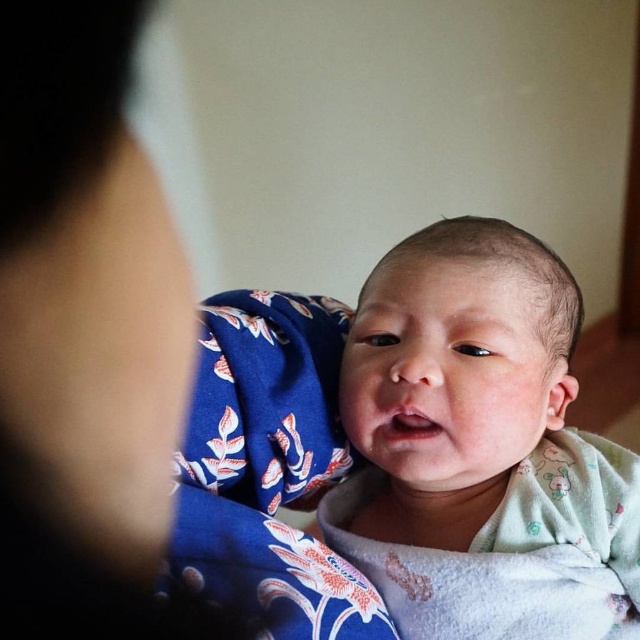
You are a photographer taking a closeup shot of a baby. You notice the smooth skin at upper left and the soft white swaddle at center. Which object is wider?

The smooth skin at upper left has a lesser width compared to the soft white swaddle at center, so the soft white swaddle at center is wider.

You are a photographer capturing the baby in the image. You need to adjust your focus to ensure both the smooth skin at upper left and the soft white swaddle at center are in sharp detail. Which object should you focus on first to account for their relative sizes?

The smooth skin at upper left has a lesser height compared to the soft white swaddle at center, so you should focus on the soft white swaddle at center first since it is larger and requires more detailed attention.